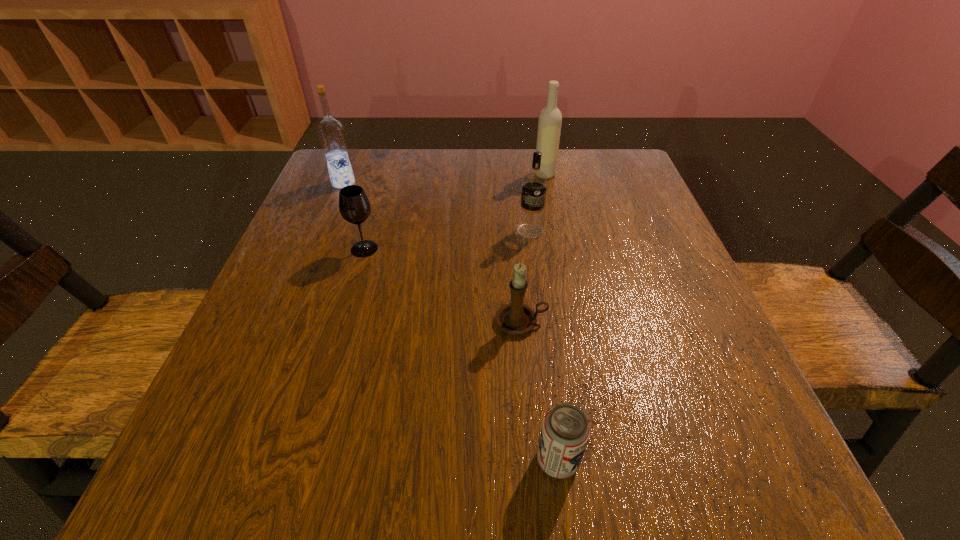
The image size is (960, 540). I want to click on free space at the right edge of the desktop, so click(x=734, y=377).

You are a GUI agent. You are given a task and a screenshot of the screen. Output one action in this format:
    pyautogui.click(x=<x>, y=<y>)
    Task: Click on the vacant space at the far left corner of the desktop
    This screenshot has width=960, height=540.
    Given the screenshot: What is the action you would take?
    pyautogui.click(x=322, y=190)

Image resolution: width=960 pixels, height=540 pixels. Find the location of `vacant area at the far right corner`. vacant area at the far right corner is located at coordinates (591, 188).

The image size is (960, 540). Find the location of `vacant area that lies between the candle holder and the second object from left to right`. vacant area that lies between the candle holder and the second object from left to right is located at coordinates (443, 285).

At what (x,y) coordinates should I click in order to perform the action: click on vacant area between the leftmost object and the nearest vodka. Please return your answer as a coordinate pair (x, y). Looking at the image, I should click on (437, 207).

This screenshot has height=540, width=960. I want to click on unoccupied position between the shortest object and the third tallest object, so click(x=544, y=345).

Locate an element on the screen. The width and height of the screenshot is (960, 540). free spot between the second nearest object and the leftmost object is located at coordinates (432, 252).

The height and width of the screenshot is (540, 960). What are the coordinates of `vacant space that's between the leftmost object and the nearest object` in the screenshot? It's located at (450, 321).

You are a GUI agent. You are given a task and a screenshot of the screen. Output one action in this format:
    pyautogui.click(x=<x>, y=<y>)
    Task: Click on the free space between the leftmost vodka and the shortest object
    The height and width of the screenshot is (540, 960).
    Given the screenshot: What is the action you would take?
    pyautogui.click(x=450, y=321)

Locate an element on the screen. This screenshot has width=960, height=540. object that stands as the fifth closest to the fourth farthest object is located at coordinates (565, 431).